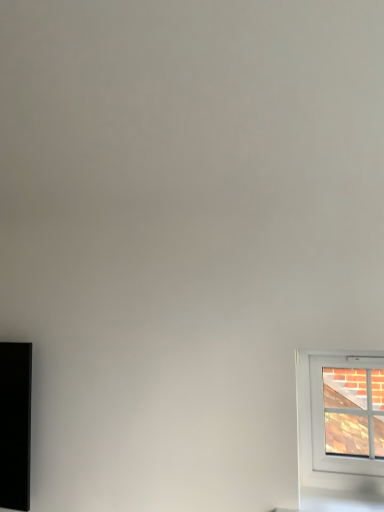
Where is `white plastic window at lower right`? This screenshot has height=512, width=384. white plastic window at lower right is located at coordinates (340, 415).

Image resolution: width=384 pixels, height=512 pixels. Describe the element at coordinates (340, 415) in the screenshot. I see `white plastic window at lower right` at that location.

At what (x,y) coordinates should I click in order to perform the action: click on white plastic window at lower right. Please return your answer as a coordinate pair (x, y). Looking at the image, I should click on (340, 415).